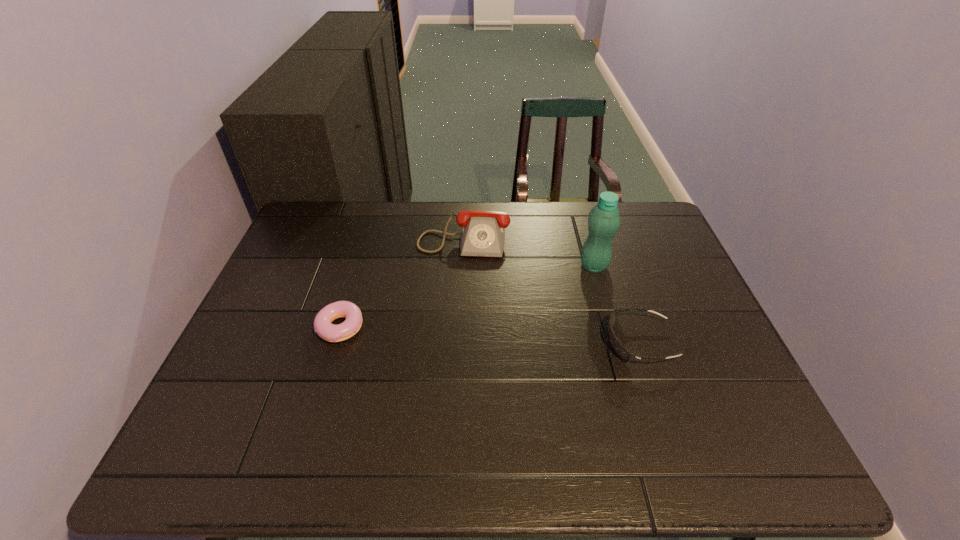
Identify the location of vacant point that satisfies the following two spatial constraints: 1. on the back side of the shortest object; 2. on the left side of the tallest object. The width and height of the screenshot is (960, 540). (358, 266).

This screenshot has height=540, width=960. Identify the location of free point that satisfies the following two spatial constraints: 1. on the back side of the shortest object; 2. on the left side of the water bottle. (358, 266).